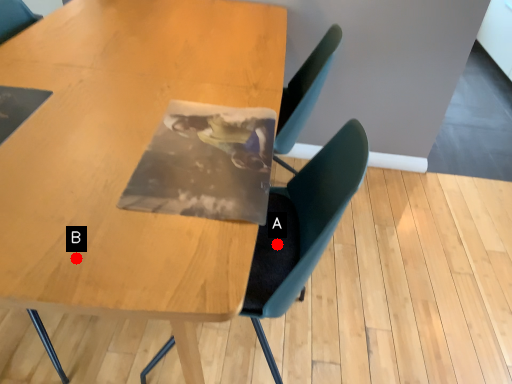
Question: Two points are circled on the image, labeled by A and B beside each circle. Which point appears farthest from the camera in this image?

Choices:
 (A) A is further
 (B) B is further

Answer: (A)